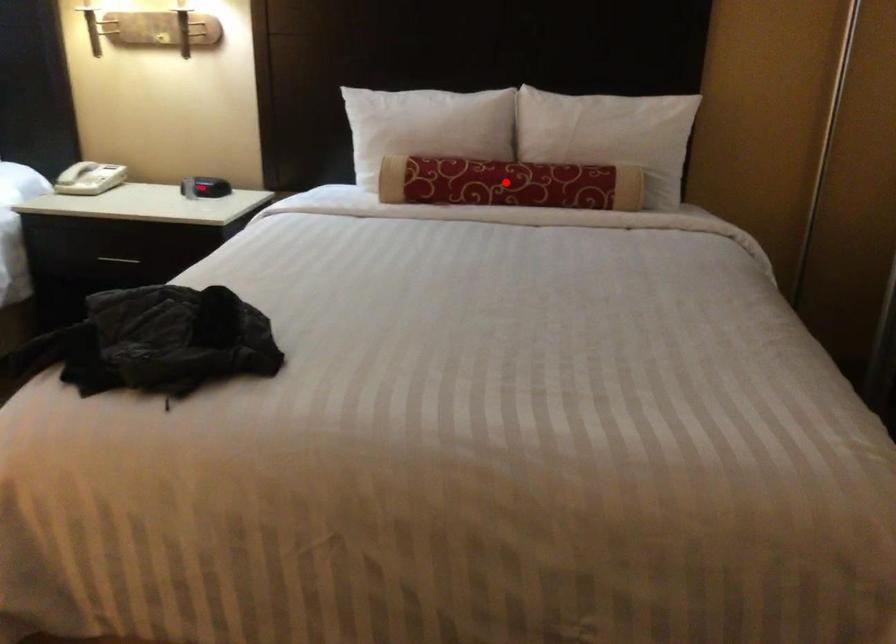
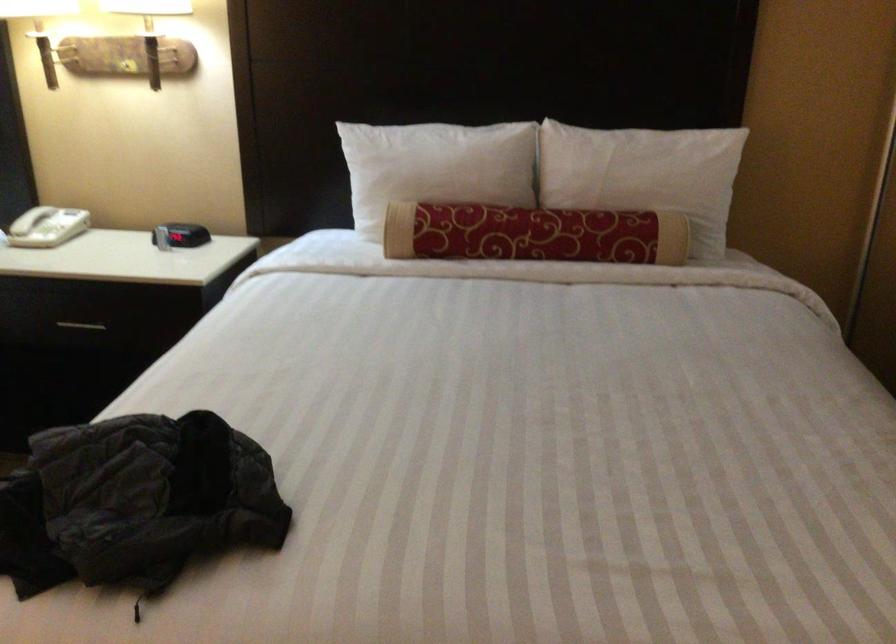
The point at the highlighted location is marked in the first image. Where is the corresponding point in the second image?

(533, 234)